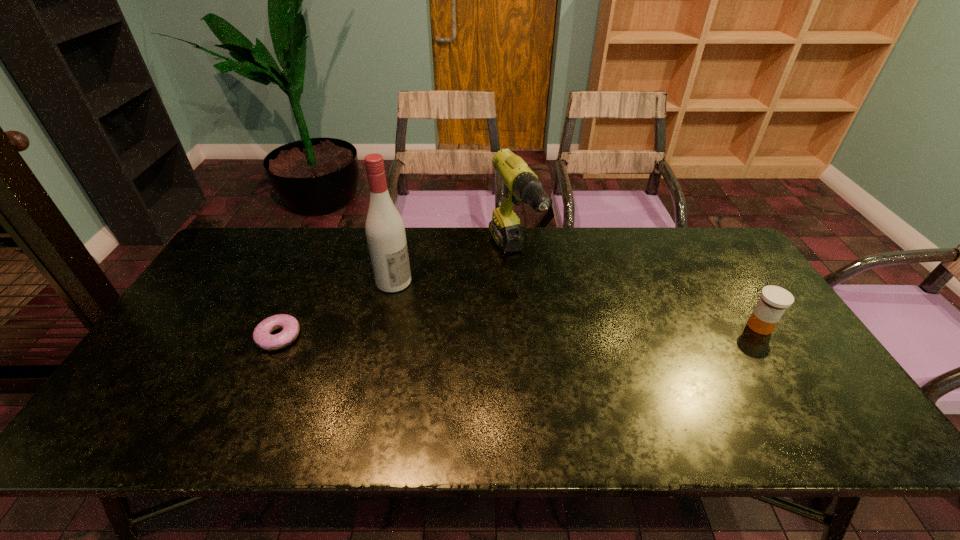
This screenshot has height=540, width=960. I want to click on free space that is in between the shortest object and the alcohol, so click(336, 309).

Locate an element on the screen. vacant space in between the third object from right to left and the third tallest object is located at coordinates (577, 304).

The width and height of the screenshot is (960, 540). I want to click on free spot between the rightmost object and the third shortest object, so click(x=636, y=292).

Where is `vacant point located between the doughnut and the third tallest object`? This screenshot has height=540, width=960. vacant point located between the doughnut and the third tallest object is located at coordinates (519, 331).

Locate an element on the screen. Image resolution: width=960 pixels, height=540 pixels. vacant space that is in between the doughnut and the tallest object is located at coordinates (336, 309).

The image size is (960, 540). I want to click on the closest object relative to the second object from right to left, so click(385, 231).

In order to click on object that is the third closest to the alcohol in this screenshot , I will do `click(774, 300)`.

Identify the location of free spot that satisfies the following two spatial constraints: 1. on the back side of the third object from right to left; 2. on the right side of the drill. (399, 258).